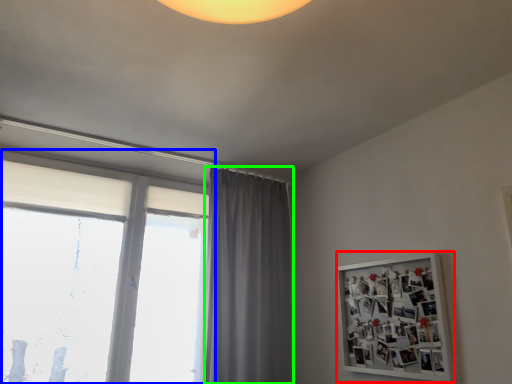
Question: Which is nearer to the bulletin board (highlighted by a red box)? window (highlighted by a blue box) or curtain (highlighted by a green box).

Choices:
 (A) window
 (B) curtain

Answer: (B)